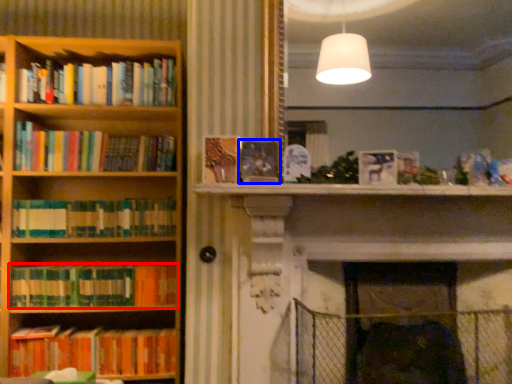
Question: Which point is closer to the camera, book (highlighted by a red box) or book (highlighted by a blue box)?

Choices:
 (A) book
 (B) book

Answer: (B)